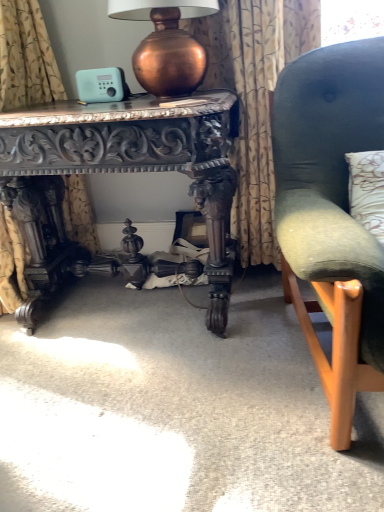
Question: Considering the relative positions of floral-patterned fabric at center, positioned as the 1th curtain in right-to-left order, and gold floral fabric at left, which is the 1th curtain in left-to-right order, in the image provided, is floral-patterned fabric at center, positioned as the 1th curtain in right-to-left order, to the left of gold floral fabric at left, which is the 1th curtain in left-to-right order, from the viewer's perspective?

Choices:
 (A) yes
 (B) no

Answer: (B)

Question: From a real-world perspective, is floral-patterned fabric at center, positioned as the 1th curtain in right-to-left order, on gold floral fabric at left, which is the 1th curtain in left-to-right order?

Choices:
 (A) yes
 (B) no

Answer: (B)

Question: Does floral-patterned fabric at center, positioned as the 1th curtain in right-to-left order, lie behind gold floral fabric at left, which is the 1th curtain in left-to-right order?

Choices:
 (A) yes
 (B) no

Answer: (A)

Question: Is floral-patterned fabric at center, positioned as the 1th curtain in right-to-left order, far away from gold floral fabric at left, the second curtain when ordered from right to left?

Choices:
 (A) no
 (B) yes

Answer: (A)

Question: Would you say floral-patterned fabric at center, positioned as the 1th curtain in right-to-left order, is outside gold floral fabric at left, the second curtain when ordered from right to left?

Choices:
 (A) yes
 (B) no

Answer: (A)

Question: Considering the relative positions of floral-patterned fabric at center, positioned as the 1th curtain in right-to-left order, and gold floral fabric at left, which is the 1th curtain in left-to-right order, in the image provided, is floral-patterned fabric at center, positioned as the 1th curtain in right-to-left order, to the right of gold floral fabric at left, which is the 1th curtain in left-to-right order, from the viewer's perspective?

Choices:
 (A) yes
 (B) no

Answer: (A)

Question: Does copper metallic table lamp at upper center have a lesser width compared to velvet green chair at right?

Choices:
 (A) yes
 (B) no

Answer: (A)

Question: Is copper metallic table lamp at upper center at the left side of velvet green chair at right?

Choices:
 (A) no
 (B) yes

Answer: (B)

Question: From the image's perspective, would you say copper metallic table lamp at upper center is shown under velvet green chair at right?

Choices:
 (A) no
 (B) yes

Answer: (A)

Question: Is copper metallic table lamp at upper center turned away from velvet green chair at right?

Choices:
 (A) yes
 (B) no

Answer: (B)

Question: Is copper metallic table lamp at upper center to the right of velvet green chair at right from the viewer's perspective?

Choices:
 (A) no
 (B) yes

Answer: (A)

Question: Could you tell me if copper metallic table lamp at upper center is turned towards velvet green chair at right?

Choices:
 (A) yes
 (B) no

Answer: (B)

Question: From a real-world perspective, is velvet green chair at right positioned under gold floral fabric at left, the second curtain when ordered from right to left, based on gravity?

Choices:
 (A) no
 (B) yes

Answer: (B)